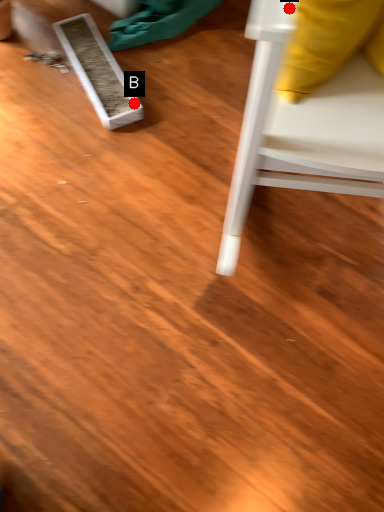
Question: Two points are circled on the image, labeled by A and B beside each circle. Which point appears farthest from the camera in this image?

Choices:
 (A) A is further
 (B) B is further

Answer: (B)